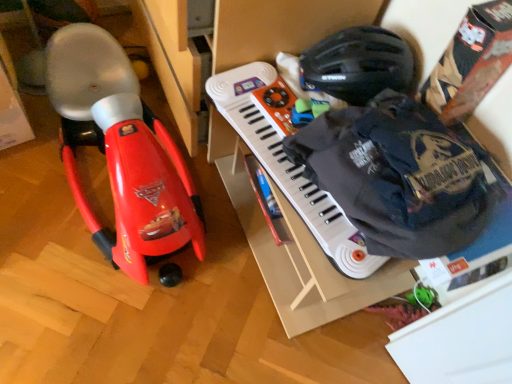
Question: Can you confirm if black matte helmet at upper right is wider than white plastic musical keyboard at center?

Choices:
 (A) yes
 (B) no

Answer: (A)

Question: Does black matte helmet at upper right lie in front of white plastic musical keyboard at center?

Choices:
 (A) no
 (B) yes

Answer: (A)

Question: From a real-world perspective, is black matte helmet at upper right over white plastic musical keyboard at center?

Choices:
 (A) yes
 (B) no

Answer: (A)

Question: Considering the relative sizes of black matte helmet at upper right and white plastic musical keyboard at center in the image provided, is black matte helmet at upper right smaller than white plastic musical keyboard at center?

Choices:
 (A) no
 (B) yes

Answer: (A)

Question: Is there a large distance between black matte helmet at upper right and white plastic musical keyboard at center?

Choices:
 (A) yes
 (B) no

Answer: (B)

Question: Is black matte helmet at upper right thinner than white plastic musical keyboard at center?

Choices:
 (A) no
 (B) yes

Answer: (A)

Question: Is matte red toy car at left looking in the opposite direction of white plastic musical keyboard at center?

Choices:
 (A) yes
 (B) no

Answer: (B)

Question: From a real-world perspective, is matte red toy car at left located beneath white plastic musical keyboard at center?

Choices:
 (A) no
 (B) yes

Answer: (B)

Question: Is matte red toy car at left wider than white plastic musical keyboard at center?

Choices:
 (A) no
 (B) yes

Answer: (B)

Question: Does matte red toy car at left have a lesser width compared to white plastic musical keyboard at center?

Choices:
 (A) no
 (B) yes

Answer: (A)

Question: Can you see matte red toy car at left touching white plastic musical keyboard at center?

Choices:
 (A) yes
 (B) no

Answer: (B)

Question: From the image's perspective, is matte red toy car at left located above white plastic musical keyboard at center?

Choices:
 (A) no
 (B) yes

Answer: (B)

Question: Is black matte helmet at upper right next to matte red toy car at left and touching it?

Choices:
 (A) no
 (B) yes

Answer: (A)